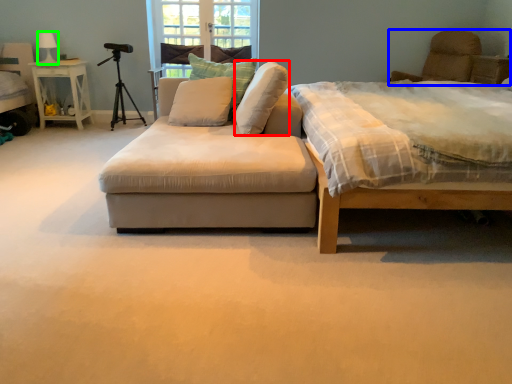
Question: Based on their relative distances, which object is farther from pillow (highlighted by a red box)? Choose from swivel chair (highlighted by a blue box) and lamp (highlighted by a green box).

Choices:
 (A) swivel chair
 (B) lamp

Answer: (A)